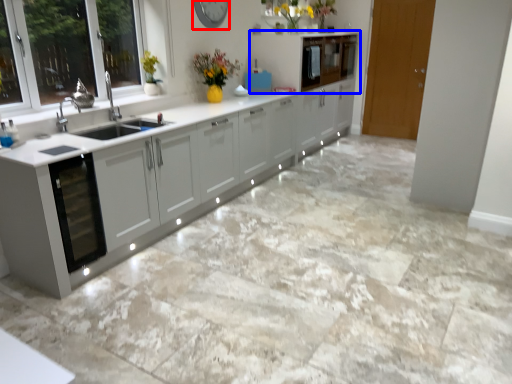
Question: Which object is closer to the camera taking this photo, clock (highlighted by a red box) or cabinetry (highlighted by a blue box)?

Choices:
 (A) clock
 (B) cabinetry

Answer: (A)